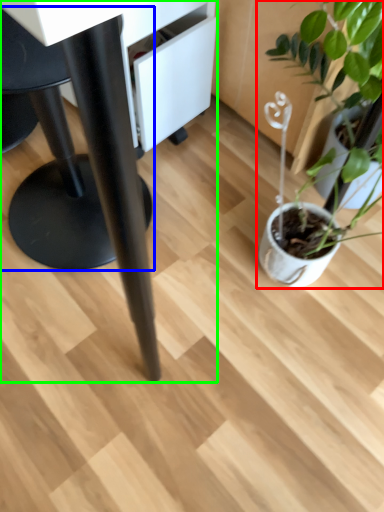
Question: Which object is positioned farthest from houseplant (highlighted by a red box)? Select from swivel chair (highlighted by a blue box) and table (highlighted by a green box).

Choices:
 (A) swivel chair
 (B) table

Answer: (A)